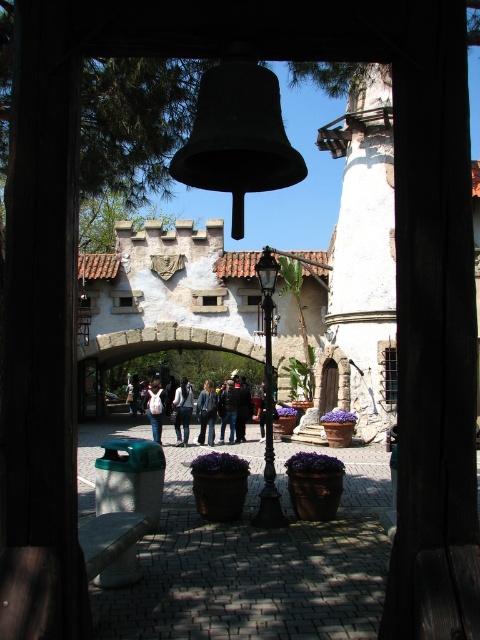
You are a visitor at this historical site and see a denim jacket at center and dark blue jeans at center. Which item is closer to the ground?

The denim jacket at center is positioned under dark blue jeans at center, so the denim jacket at center is closer to the ground.

You are a tailor observing two pairs of jeans in the courtyard scene. The blue denim jeans at center and the dark blue jeans at center. Which pair is taller?

The blue denim jeans at center is much taller than the dark blue jeans at center.

Consider the image. You are standing in the courtyard and see the dark blue jeans at center. Where exactly are the dark blue jeans located in the scene?

The dark blue jeans at center are located at the 2D coordinates point (x=228, y=410) in the scene.